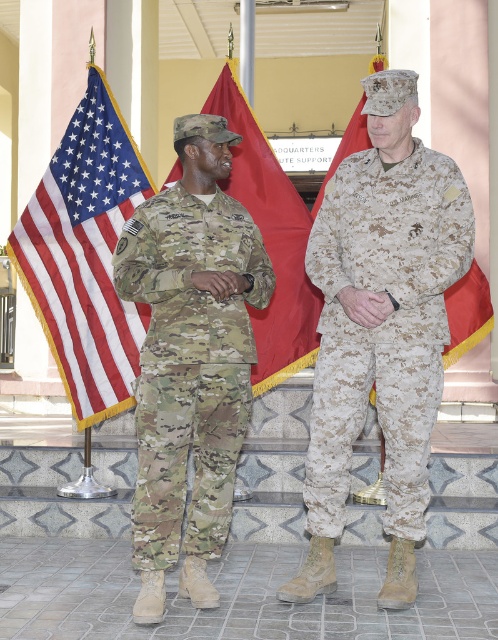
Does digital camouflage uniform at center have a larger size compared to multicam uniform at left?

Yes.

Between digital camouflage uniform at center and multicam uniform at left, which one has less height?

With less height is multicam uniform at left.

Describe the element at coordinates (383, 324) in the screenshot. I see `digital camouflage uniform at center` at that location.

This screenshot has height=640, width=498. What are the coordinates of `digital camouflage uniform at center` in the screenshot? It's located at (383, 324).

Who is taller, matte fabric flag at left or red fabric flag at upper center?

matte fabric flag at left is taller.

Find the location of a particular element. matte fabric flag at left is located at coordinates (86, 256).

Does point (113, 312) lie behind point (280, 273)?

Yes.

Does matte fabric flag at left come in front of red fabric flag at center?

No, it is not.

Is point (76, 147) closer to viewer compared to point (292, 246)?

No, it is behind (292, 246).

Where is `matte fabric flag at left`? The width and height of the screenshot is (498, 640). matte fabric flag at left is located at coordinates (86, 256).